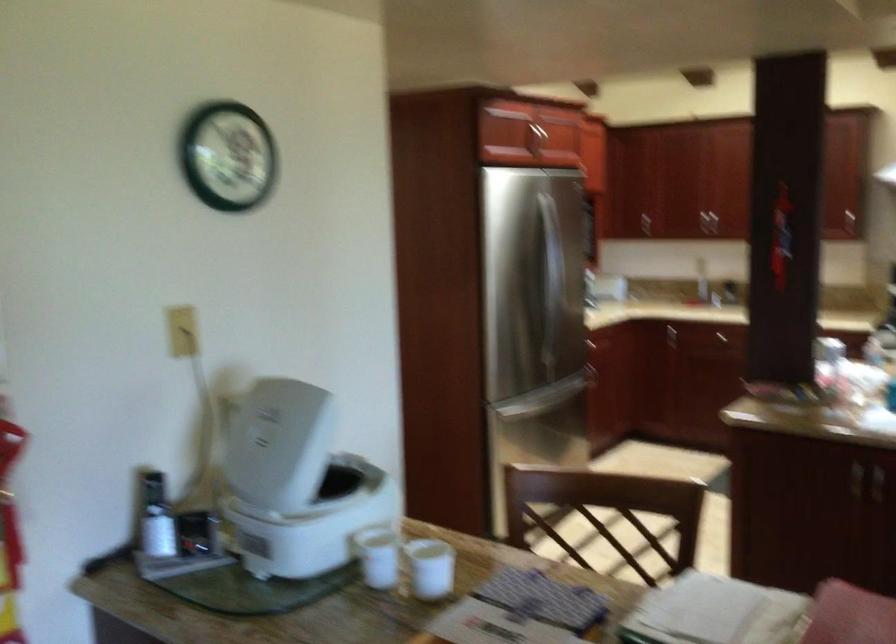
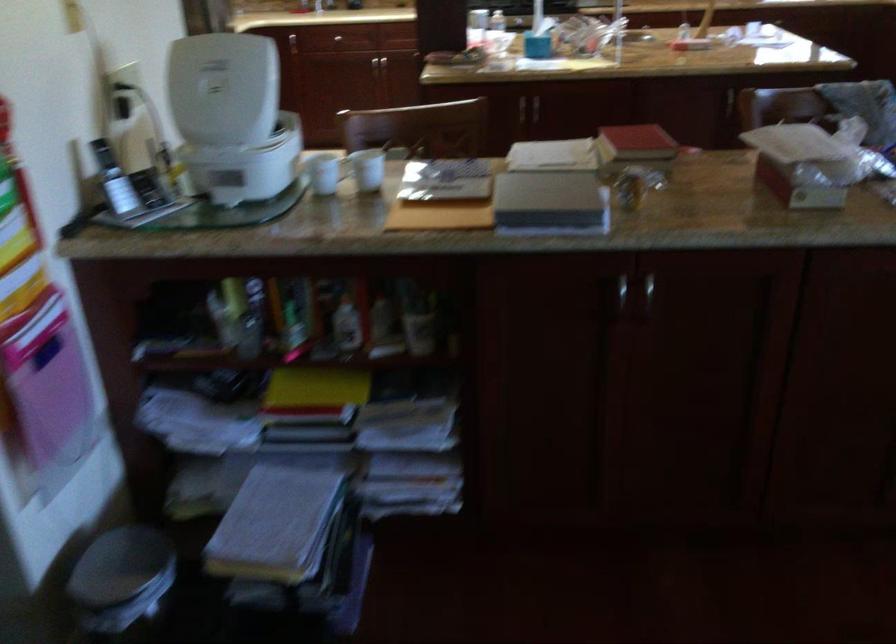
Looking at this image, based on the continuous images, in which direction is the camera rotating?

The rotation direction of the camera is right-down.